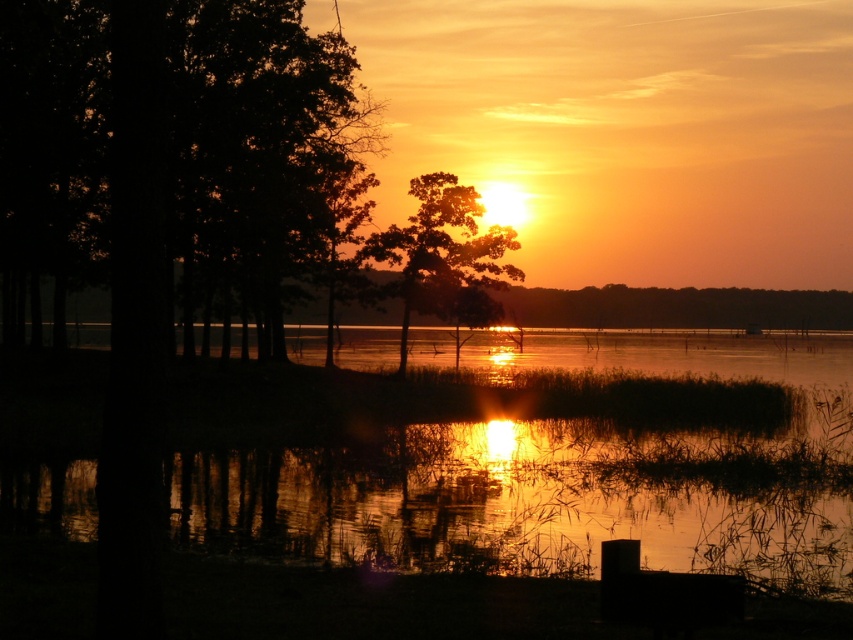
Can you confirm if glistening reflective water at center is smaller than dark brown wood trees at left?

Correct, glistening reflective water at center occupies less space than dark brown wood trees at left.

Is point (369, 486) behind point (326, 122)?

That is False.

Where is `glistening reflective water at center`? This screenshot has height=640, width=853. glistening reflective water at center is located at coordinates (560, 472).

Which is behind, point (460, 358) or point (445, 230)?

The point (460, 358) is behind.

Identify the location of glistening reflective water at center. (560, 472).

Measure the distance between dark brown wood trees at left and camera.

→ 25.70 feet

Can you confirm if dark brown wood trees at left is thinner than silhouette tree at center?

In fact, dark brown wood trees at left might be wider than silhouette tree at center.

Who is more distant from viewer, (88, 259) or (461, 278)?

Point (461, 278)

This screenshot has height=640, width=853. Identify the location of dark brown wood trees at left. (177, 148).